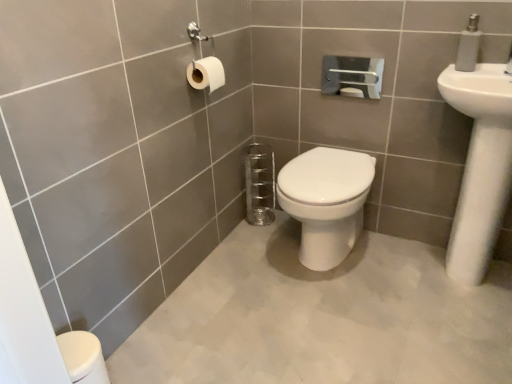
At what (x,y) coordinates should I click in order to perform the action: click on vacant space in front of white glossy sink at upper right. Please return your answer as a coordinate pair (x, y). Looking at the image, I should click on (461, 326).